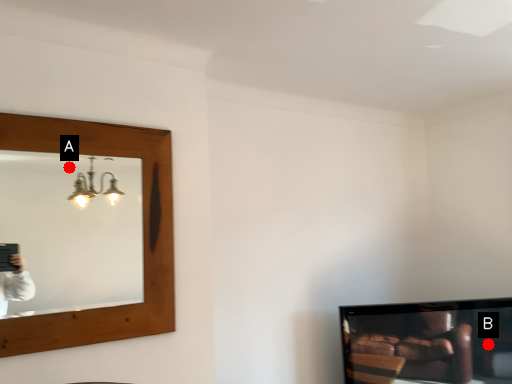
Question: Two points are circled on the image, labeled by A and B beside each circle. Which of the following is the farthest from the observer?

Choices:
 (A) A is further
 (B) B is further

Answer: (A)